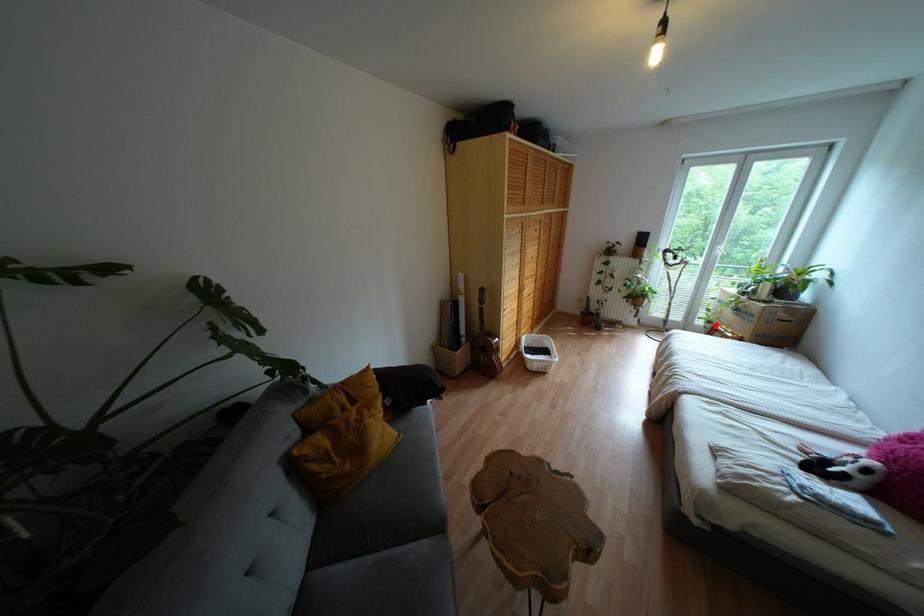
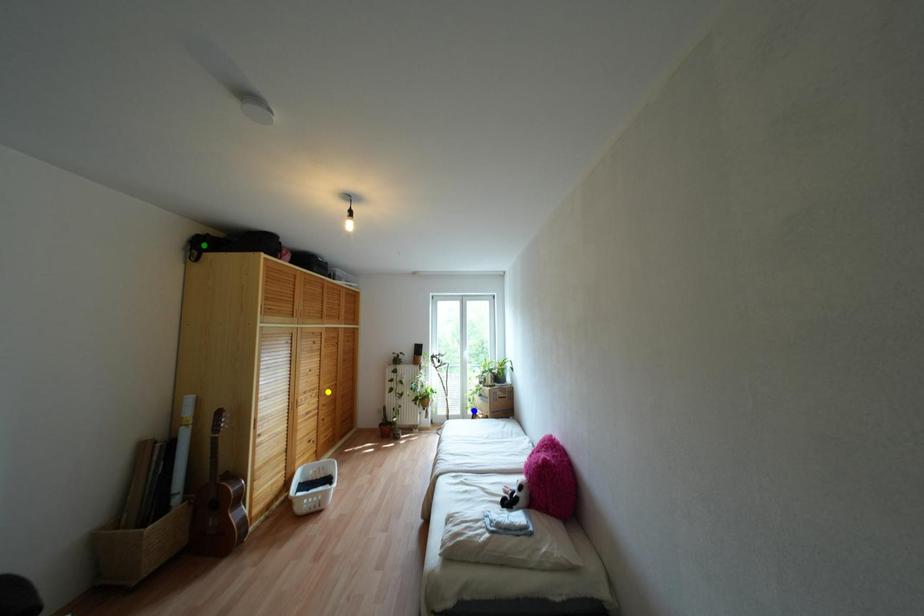
Question: I am providing you with two images of the same scene from different viewpoints. A red point is marked on the first image. You are given multiple points on the second image. Which point in image 2 is actually the same real-world point as the red point in image 1?

Choices:
 (A) yellow point
 (B) green point
 (C) blue point

Answer: (C)